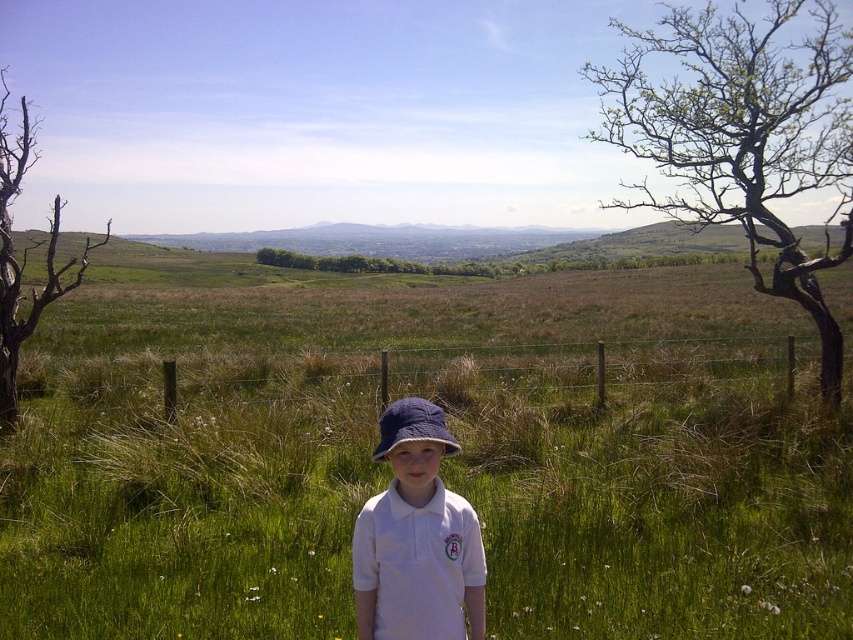
Is point (791, 96) more distant than point (410, 404)?

That is True.

At what (x,y) coordinates should I click in order to perform the action: click on bare wood tree at upper right. Please return your answer as a coordinate pair (x, y). Looking at the image, I should click on (741, 136).

Is point (848, 44) farther from viewer compared to point (389, 428)?

Yes, point (848, 44) is farther from viewer.

Locate an element on the screen. Image resolution: width=853 pixels, height=640 pixels. bare wood tree at upper right is located at coordinates (741, 136).

Between white cotton shirt at center and brown dead wood at left, which one appears on the left side from the viewer's perspective?

brown dead wood at left

Is point (471, 529) more distant than point (82, 268)?

No.

I want to click on white cotton shirt at center, so click(x=416, y=538).

Can you confirm if bare wood tree at upper right is thinner than white cotton shirt at center?

Incorrect, bare wood tree at upper right's width is not less than white cotton shirt at center's.

Can you confirm if bare wood tree at upper right is taller than white cotton shirt at center?

Yes.

Measure the distance between bare wood tree at upper right and camera.

The distance of bare wood tree at upper right from camera is 37.54 feet.

Where is `bare wood tree at upper right`? The height and width of the screenshot is (640, 853). bare wood tree at upper right is located at coordinates (741, 136).